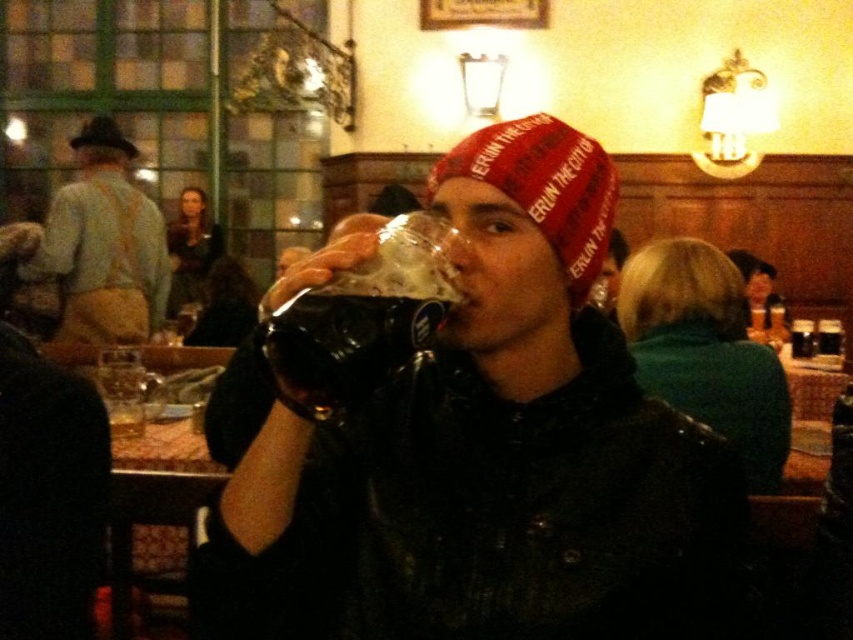
You are a delivery person who needs to place a small package between the matte black jacket at center and the black felt hat at upper left. The package requires a minimum of 10 feet of space between them to be placed safely. Can you safely place the package between these two items?

The matte black jacket at center is 12.56 feet away from the black felt hat at upper left, so yes, the package can be safely placed between them as the distance meets the required minimum of 10 feet.

Based on the photo, you are a photographer trying to capture a candid shot of the scene. You notice the matte black jacket at center and the black felt hat at upper left. Which object should you focus on to ensure it appears larger in your photo?

The matte black jacket at center should be focused on because it is much taller than the black felt hat at upper left, making it appear larger in the photo.

You are a barista working in the pub and need to place a new menu board between the light brown leather jacket at upper left and the black felt hat at upper left. The menu board is 22 inches wide. Can it fit between them without overlapping either item?

The distance between the light brown leather jacket at upper left and the black felt hat at upper left is 20.99 inches. Since the menu board is 22 inches wide, it cannot fit between them without overlapping one or both items.